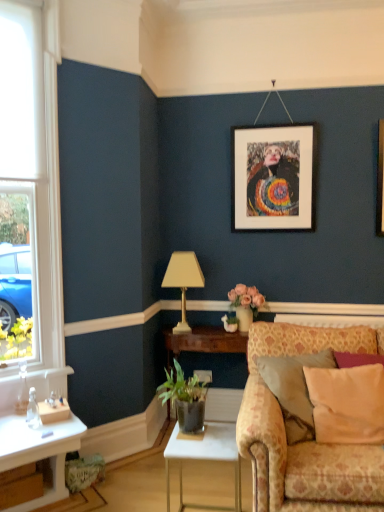
Question: Considering the relative sizes of beige fabric pillow at right and gold metallic table lamp at center in the image provided, is beige fabric pillow at right shorter than gold metallic table lamp at center?

Choices:
 (A) yes
 (B) no

Answer: (A)

Question: From a real-world perspective, is beige fabric pillow at right below gold metallic table lamp at center?

Choices:
 (A) no
 (B) yes

Answer: (B)

Question: Is beige fabric pillow at right oriented away from gold metallic table lamp at center?

Choices:
 (A) no
 (B) yes

Answer: (A)

Question: Is beige fabric pillow at right not near gold metallic table lamp at center?

Choices:
 (A) no
 (B) yes

Answer: (B)

Question: Is beige fabric pillow at right thinner than gold metallic table lamp at center?

Choices:
 (A) yes
 (B) no

Answer: (A)

Question: Is white glossy table at center taller or shorter than gold metallic table lamp at center?

Choices:
 (A) tall
 (B) short

Answer: (B)

Question: From a real-world perspective, is white glossy table at center positioned above or below gold metallic table lamp at center?

Choices:
 (A) below
 (B) above

Answer: (A)

Question: Considering the positions of point click(233, 431) and point click(185, 295), is point click(233, 431) closer or farther from the camera than point click(185, 295)?

Choices:
 (A) closer
 (B) farther

Answer: (A)

Question: Do you think white glossy table at center is within gold metallic table lamp at center, or outside of it?

Choices:
 (A) outside
 (B) inside

Answer: (A)

Question: Based on their positions, is floral-patterned fabric couch at lower right located to the left or right of beige fabric pillow at right?

Choices:
 (A) left
 (B) right

Answer: (A)

Question: From a real-world perspective, relative to beige fabric pillow at right, is floral-patterned fabric couch at lower right vertically above or below?

Choices:
 (A) above
 (B) below

Answer: (B)

Question: Choose the correct answer: Is floral-patterned fabric couch at lower right inside beige fabric pillow at right or outside it?

Choices:
 (A) outside
 (B) inside

Answer: (A)

Question: In the image, is floral-patterned fabric couch at lower right positioned in front of or behind beige fabric pillow at right?

Choices:
 (A) front
 (B) behind

Answer: (A)

Question: From a real-world perspective, is white glossy table at center above or below white matte picture frame at upper center?

Choices:
 (A) above
 (B) below

Answer: (B)

Question: Relative to white matte picture frame at upper center, is white glossy table at center in front or behind?

Choices:
 (A) front
 (B) behind

Answer: (A)